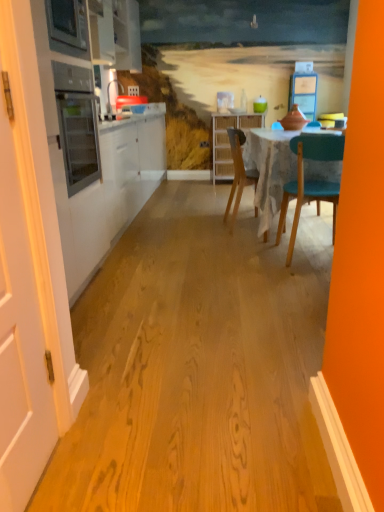
Question: Is wooden chair at center inside the boundaries of woven wood cabinet at center, the 2th cabinetry viewed from the left, or outside?

Choices:
 (A) outside
 (B) inside

Answer: (A)

Question: Considering the relative positions of wooden chair at center and woven wood cabinet at center, the first cabinetry positioned from the back, in the image provided, is wooden chair at center to the left or to the right of woven wood cabinet at center, the first cabinetry positioned from the back,?

Choices:
 (A) right
 (B) left

Answer: (B)

Question: Estimate the real-world distances between objects in this image. Which object is farther from the wooden chair at center?

Choices:
 (A) white matte door at left
 (B) white glossy cabinet at upper left, the 1th cabinetry when ordered from front to back
 (C) woven wood cabinet at center, the first cabinetry positioned from the back

Answer: (A)

Question: Based on their relative distances, which object is nearer to the woven wood cabinet at center, the 2th cabinetry viewed from the left?

Choices:
 (A) wooden chair at center
 (B) white matte door at left
 (C) white glossy cabinet at upper left, which is the 2th cabinetry from right to left

Answer: (A)